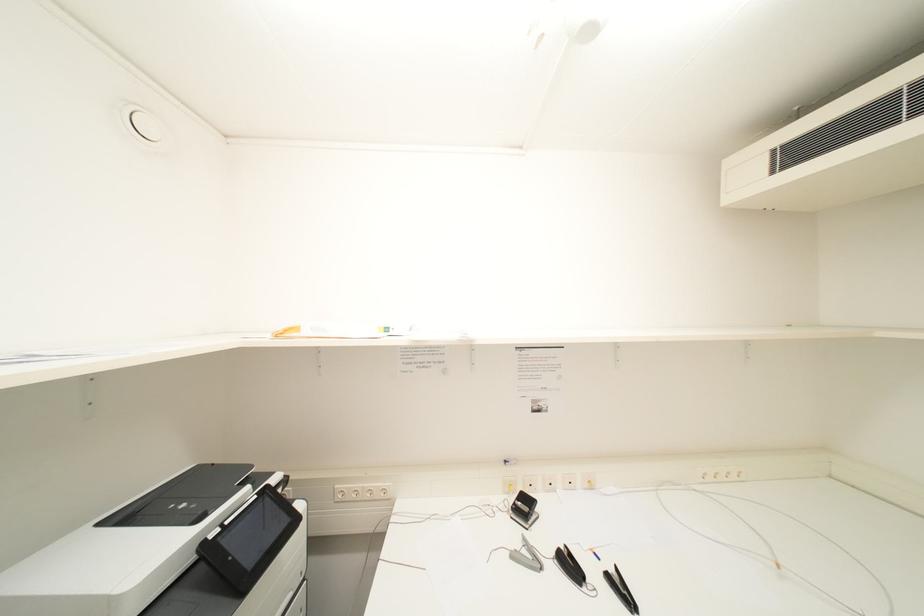
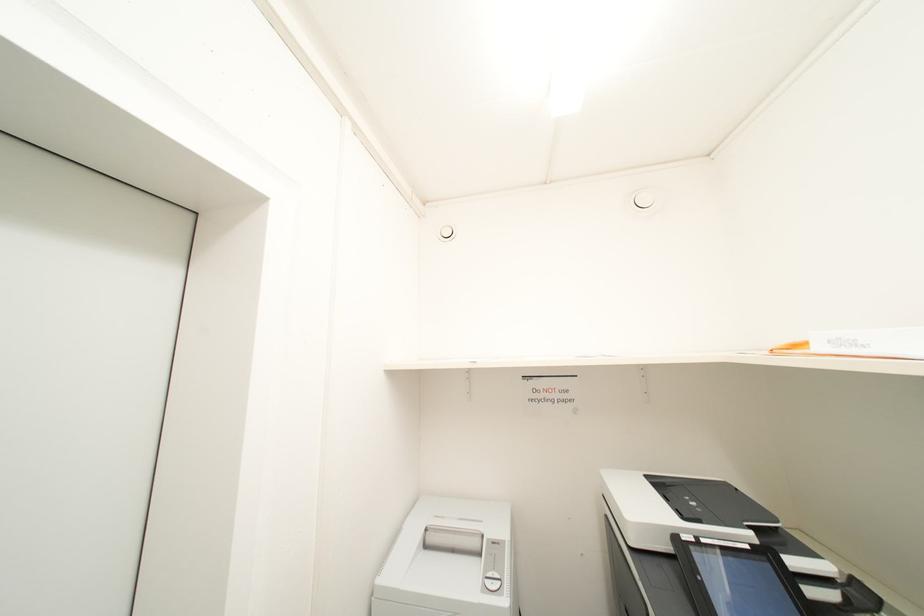
Question: The camera is either moving clockwise (left) or counter-clockwise (right) around the object. The first image is from the beginning of the video and the second image is from the end. Is the camera moving left or right when shooting the video?

Choices:
 (A) Left
 (B) Right

Answer: (B)